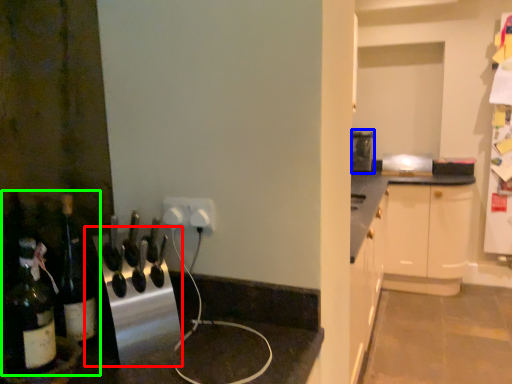
Question: Which is nearer to the appliance (highlighted by a red box)? appliance (highlighted by a blue box) or wine tasting (highlighted by a green box).

Choices:
 (A) appliance
 (B) wine tasting

Answer: (B)